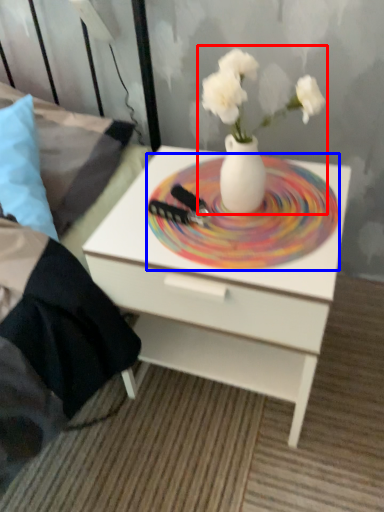
Question: Which of the following is the closest to the observer, floral arrangement (highlighted by a red box) or plate (highlighted by a blue box)?

Choices:
 (A) floral arrangement
 (B) plate

Answer: (A)